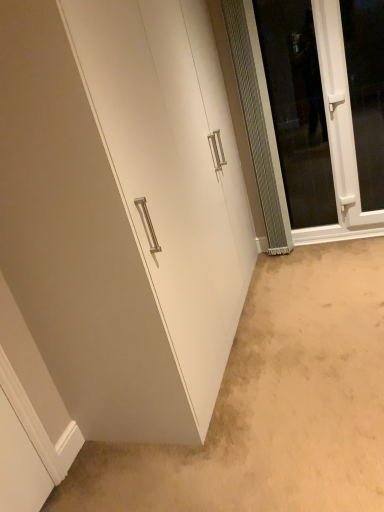
Question: Should I look upward or downward to see white matte cabinet at lower left?

Choices:
 (A) up
 (B) down

Answer: (B)

Question: Considering the relative sizes of clear glass screen door at right and white matte cabinet at lower left in the image provided, is clear glass screen door at right shorter than white matte cabinet at lower left?

Choices:
 (A) yes
 (B) no

Answer: (B)

Question: Considering the relative sizes of clear glass screen door at right and white matte cabinet at lower left in the image provided, is clear glass screen door at right thinner than white matte cabinet at lower left?

Choices:
 (A) no
 (B) yes

Answer: (B)

Question: Would you say clear glass screen door at right is a long distance from white matte cabinet at lower left?

Choices:
 (A) no
 (B) yes

Answer: (B)

Question: From the image's perspective, does clear glass screen door at right appear higher than white matte cabinet at lower left?

Choices:
 (A) yes
 (B) no

Answer: (A)

Question: Considering the relative positions of clear glass screen door at right and white matte cabinet at lower left in the image provided, is clear glass screen door at right to the left of white matte cabinet at lower left from the viewer's perspective?

Choices:
 (A) no
 (B) yes

Answer: (A)

Question: Does clear glass screen door at right lie behind white matte cabinet at lower left?

Choices:
 (A) yes
 (B) no

Answer: (A)

Question: Is the depth of white plastic window at upper right less than that of white matte cabinet at lower left?

Choices:
 (A) yes
 (B) no

Answer: (B)

Question: Does white plastic window at upper right have a lesser height compared to white matte cabinet at lower left?

Choices:
 (A) yes
 (B) no

Answer: (B)

Question: Can you confirm if white plastic window at upper right is bigger than white matte cabinet at lower left?

Choices:
 (A) yes
 (B) no

Answer: (B)

Question: Is white plastic window at upper right not close to white matte cabinet at lower left?

Choices:
 (A) no
 (B) yes

Answer: (B)

Question: Is white plastic window at upper right further to the viewer compared to white matte cabinet at lower left?

Choices:
 (A) yes
 (B) no

Answer: (A)

Question: Is white matte cabinet at lower left at the back of white plastic window at upper right?

Choices:
 (A) no
 (B) yes

Answer: (A)

Question: Does white matte cabinet at lower left have a lesser width compared to white plastic window at upper right?

Choices:
 (A) no
 (B) yes

Answer: (A)